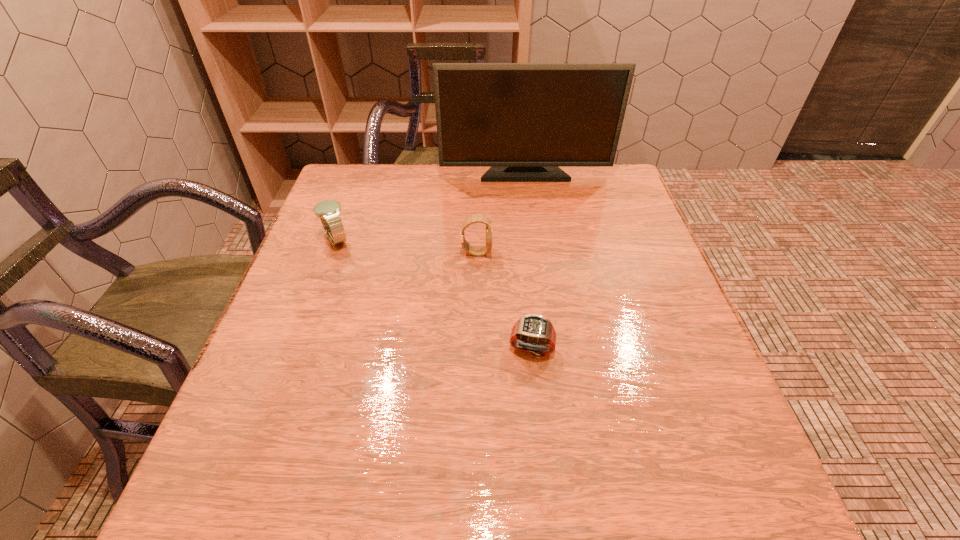
Find the location of `free space between the leftmost object and the rightmost watch`. free space between the leftmost object and the rightmost watch is located at coordinates (434, 293).

This screenshot has height=540, width=960. What are the coordinates of `free space between the monitor and the nearest object` in the screenshot? It's located at (528, 260).

Locate an element on the screen. The image size is (960, 540). empty location between the rightmost watch and the tallest object is located at coordinates (528, 260).

Image resolution: width=960 pixels, height=540 pixels. What are the coordinates of `empty space between the leftmost object and the second watch from right to left` in the screenshot? It's located at (406, 246).

Identify the location of unoccupied position between the leftmost watch and the second watch from left to right. (406, 246).

You are a GUI agent. You are given a task and a screenshot of the screen. Output one action in this format:
    pyautogui.click(x=<x>, y=<y>)
    Task: Click on the unoccupied area between the rightmost watch and the tallest object
    
    Given the screenshot: What is the action you would take?
    pyautogui.click(x=528, y=260)

In order to click on empty space that is in between the second watch from left to right and the nearest watch in this screenshot , I will do `click(504, 300)`.

Identify the location of unoccupied area between the nearest watch and the leftmost watch. Image resolution: width=960 pixels, height=540 pixels. (434, 293).

Find the location of a particular element. This screenshot has height=540, width=960. free space between the rightmost watch and the monitor is located at coordinates (528, 260).

The height and width of the screenshot is (540, 960). Identify the location of object that is the third closest to the nearest object. 523,120.